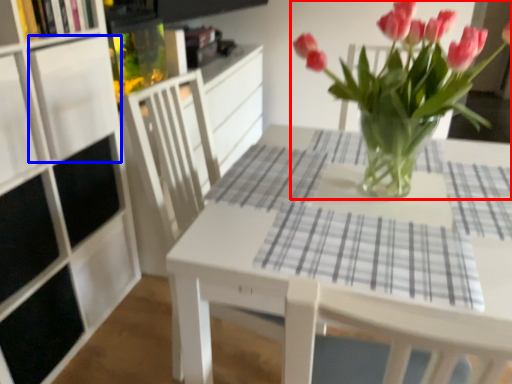
Question: Among these objects, which one is nearest to the camera, houseplant (highlighted by a red box) or shelf (highlighted by a blue box)?

Choices:
 (A) houseplant
 (B) shelf

Answer: (A)